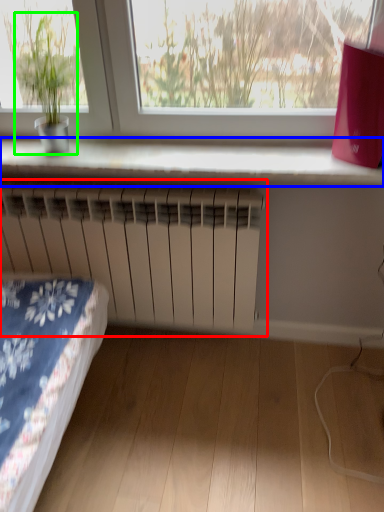
Question: Which object is positioned farthest from radiator (highlighted by a red box)? Select from window sill (highlighted by a blue box) and houseplant (highlighted by a green box).

Choices:
 (A) window sill
 (B) houseplant

Answer: (B)